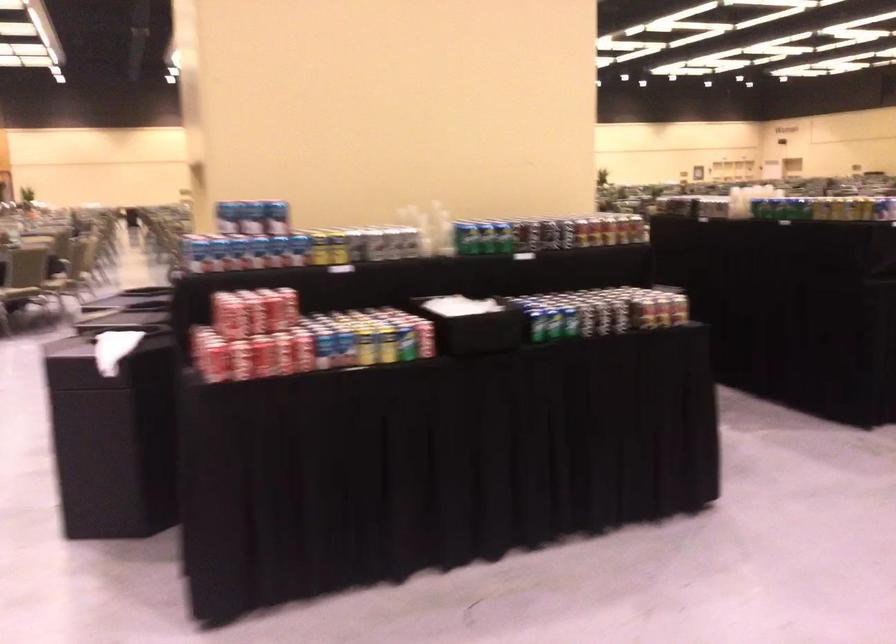
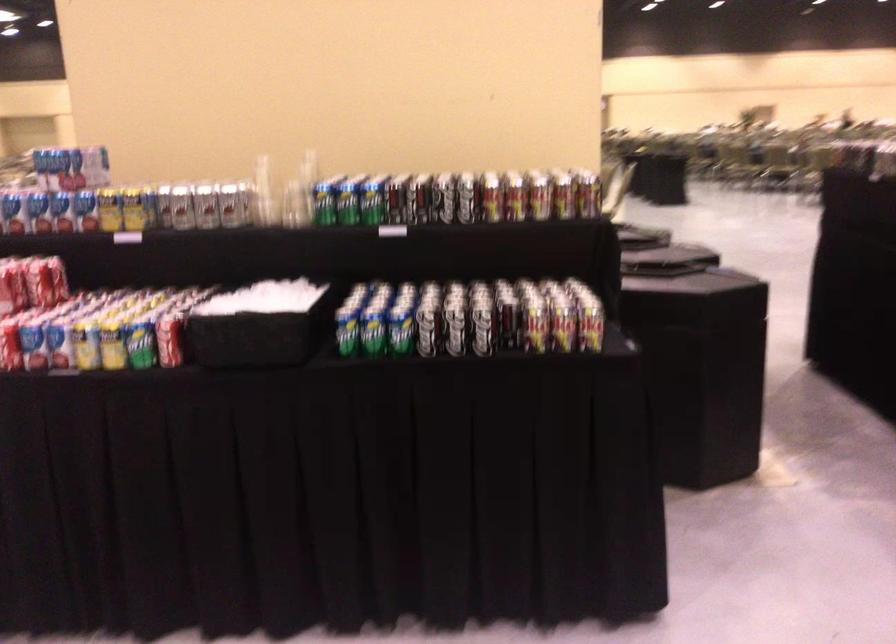
Where in the second image is the point corresponding to (273,310) from the first image?

(12, 287)